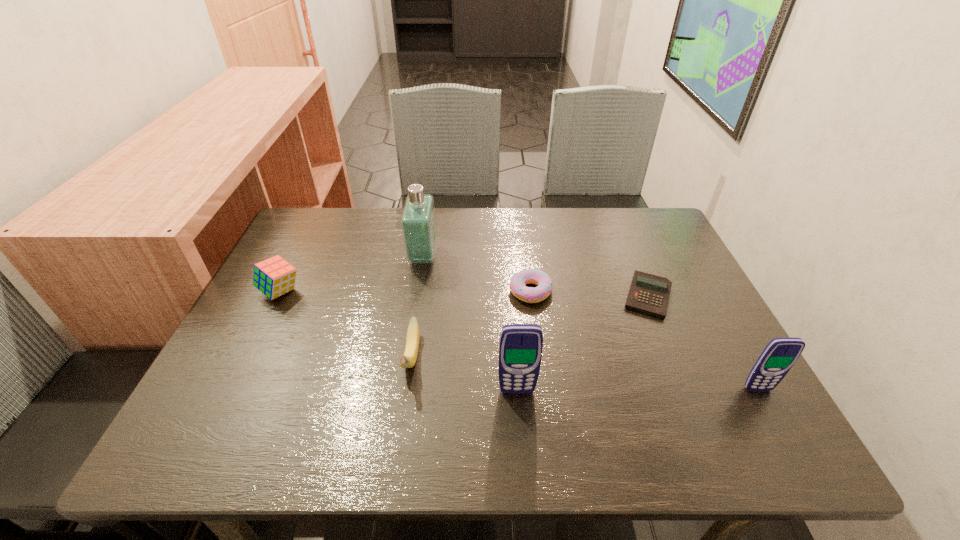
This screenshot has height=540, width=960. What are the coordinates of `vacant space that is in between the sixth shortest object and the banana` in the screenshot? It's located at (464, 374).

Identify the location of free point between the banana and the farthest object. Image resolution: width=960 pixels, height=540 pixels. pyautogui.click(x=418, y=307).

Locate which object ranks sixth in proximity to the taller cellular telephone. Please provide its 2D coordinates. Your answer should be formatted as a tuple, i.e. [(x, y)], where the tuple contains the x and y coordinates of a point satisfying the conditions above.

[(274, 277)]

Point out which object is positioned as the nearest to the leftmost object. Please provide its 2D coordinates. Your answer should be formatted as a tuple, i.e. [(x, y)], where the tuple contains the x and y coordinates of a point satisfying the conditions above.

[(418, 222)]